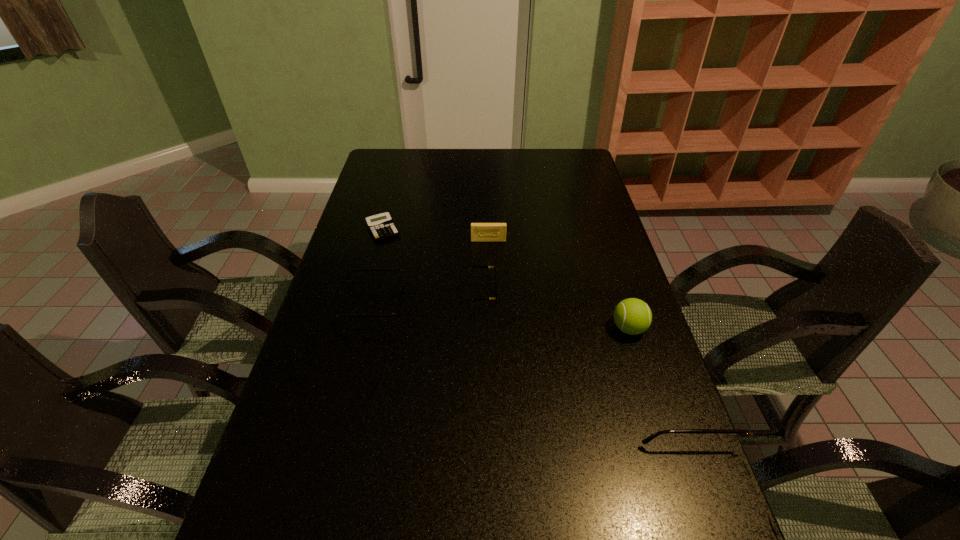
Where is `free space located 0.290m on the front-facing side of the shortest spectacles`? free space located 0.290m on the front-facing side of the shortest spectacles is located at coordinates (594, 292).

You are a GUI agent. You are given a task and a screenshot of the screen. Output one action in this format:
    pyautogui.click(x=<x>, y=<y>)
    Task: Click on the spectacles situated at the left edge
    The image size is (960, 540).
    Given the screenshot: What is the action you would take?
    pyautogui.click(x=396, y=313)

What are the coordinates of `calculator situated at the left edge` in the screenshot? It's located at (381, 226).

In order to click on object that is at the right edge in this screenshot , I will do (x=632, y=316).

This screenshot has height=540, width=960. What are the coordinates of `vacant space at the far edge of the desktop` in the screenshot? It's located at (512, 163).

In the image, there is a desktop. Where is `vacant space at the near edge`? vacant space at the near edge is located at coordinates (334, 534).

This screenshot has height=540, width=960. In the image, there is a desktop. What are the coordinates of `vacant space at the left edge` in the screenshot? It's located at pyautogui.click(x=372, y=190).

In the image, there is a desktop. Where is `vacant region at the right edge`? The width and height of the screenshot is (960, 540). vacant region at the right edge is located at coordinates (623, 296).

Find the location of a particular element. The width and height of the screenshot is (960, 540). vacant space at the far left corner of the desktop is located at coordinates (375, 177).

In the image, there is a desktop. At what (x,y) coordinates should I click in order to perform the action: click on vacant space at the near left corner. Please return your answer as a coordinate pair (x, y). This screenshot has height=540, width=960. Looking at the image, I should click on pos(294,528).